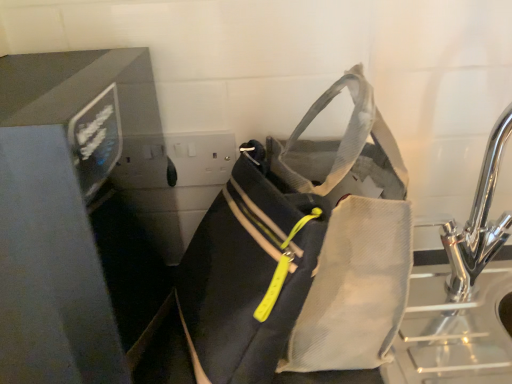
Question: Are chrome metallic sink at right and matte black bag at center making contact?

Choices:
 (A) no
 (B) yes

Answer: (A)

Question: Is chrome metallic sink at right positioned in front of matte black bag at center?

Choices:
 (A) yes
 (B) no

Answer: (B)

Question: Is matte black bag at center a part of chrome metallic sink at right?

Choices:
 (A) yes
 (B) no

Answer: (B)

Question: Considering the relative positions of chrome metallic sink at right and matte black bag at center in the image provided, is chrome metallic sink at right to the right of matte black bag at center from the viewer's perspective?

Choices:
 (A) no
 (B) yes

Answer: (B)

Question: Would you say chrome metallic sink at right is outside matte black bag at center?

Choices:
 (A) yes
 (B) no

Answer: (A)

Question: Considering the relative sizes of chrome metallic sink at right and matte black bag at center in the image provided, is chrome metallic sink at right thinner than matte black bag at center?

Choices:
 (A) yes
 (B) no

Answer: (A)

Question: Is matte black bag at center turned away from matte black monitor at left?

Choices:
 (A) yes
 (B) no

Answer: (B)

Question: Can you confirm if matte black bag at center is positioned to the right of matte black monitor at left?

Choices:
 (A) yes
 (B) no

Answer: (A)

Question: Does matte black bag at center appear on the left side of matte black monitor at left?

Choices:
 (A) no
 (B) yes

Answer: (A)

Question: Is matte black bag at center smaller than matte black monitor at left?

Choices:
 (A) yes
 (B) no

Answer: (A)

Question: Considering the relative sizes of matte black bag at center and matte black monitor at left in the image provided, is matte black bag at center shorter than matte black monitor at left?

Choices:
 (A) yes
 (B) no

Answer: (A)

Question: From the image's perspective, is matte black bag at center below matte black monitor at left?

Choices:
 (A) yes
 (B) no

Answer: (A)

Question: Is matte black monitor at left outside of chrome metallic sink at right?

Choices:
 (A) no
 (B) yes

Answer: (B)